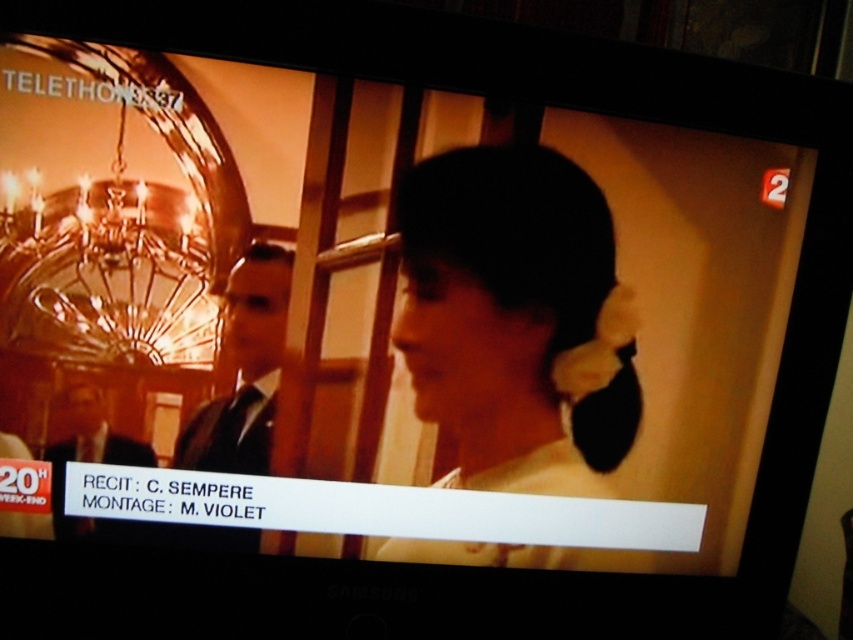
Does smooth white hairband at center have a smaller size compared to dark suit at lower left?

No.

Consider the image. Is smooth white hairband at center shorter than dark suit at lower left?

No, smooth white hairband at center is not shorter than dark suit at lower left.

Locate an element on the screen. smooth white hairband at center is located at coordinates (515, 320).

Can you confirm if black suit at center is thinner than dark suit at lower left?

Incorrect, black suit at center's width is not less than dark suit at lower left's.

Does point (276, 365) come in front of point (146, 464)?

Yes, it is.

Locate an element on the screen. This screenshot has width=853, height=640. black suit at center is located at coordinates (244, 369).

Does smooth white hairband at center appear over black suit at center?

Actually, smooth white hairband at center is below black suit at center.

Between smooth white hairband at center and black suit at center, which one is positioned higher?

black suit at center is above.

Who is more distant from viewer, (608, 388) or (216, 465)?

Point (608, 388)

Locate an element on the screen. The width and height of the screenshot is (853, 640). smooth white hairband at center is located at coordinates (515, 320).